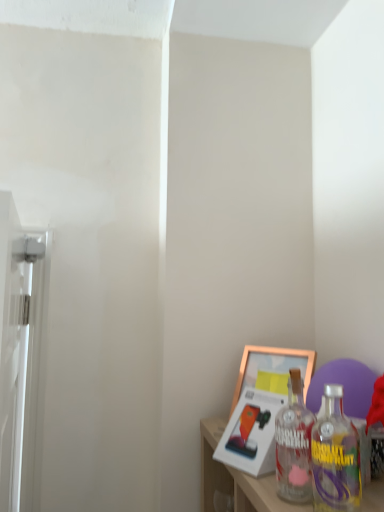
Question: From the image's perspective, would you say gold metallic picture frame at lower right, marked as the second picture frame in a front-to-back arrangement, is shown under gold metallic picture frame at lower right, acting as the 2th picture frame starting from the back?

Choices:
 (A) yes
 (B) no

Answer: (B)

Question: From a real-world perspective, is gold metallic picture frame at lower right, arranged as the first picture frame when viewed from the back, located beneath gold metallic picture frame at lower right, acting as the 2th picture frame starting from the back?

Choices:
 (A) yes
 (B) no

Answer: (B)

Question: Does gold metallic picture frame at lower right, marked as the second picture frame in a front-to-back arrangement, have a smaller size compared to gold metallic picture frame at lower right, which is counted as the first picture frame, starting from the front?

Choices:
 (A) yes
 (B) no

Answer: (B)

Question: Does gold metallic picture frame at lower right, marked as the second picture frame in a front-to-back arrangement, appear on the left side of gold metallic picture frame at lower right, which is counted as the first picture frame, starting from the front?

Choices:
 (A) no
 (B) yes

Answer: (A)

Question: Is gold metallic picture frame at lower right, marked as the second picture frame in a front-to-back arrangement, positioned behind gold metallic picture frame at lower right, acting as the 2th picture frame starting from the back?

Choices:
 (A) no
 (B) yes

Answer: (B)

Question: Is gold metallic picture frame at lower right, arranged as the first picture frame when viewed from the back, oriented towards gold metallic picture frame at lower right, which is counted as the first picture frame, starting from the front?

Choices:
 (A) no
 (B) yes

Answer: (B)

Question: Is gold metallic picture frame at lower right, acting as the 2th picture frame starting from the back, positioned in front of white glossy screen door at left?

Choices:
 (A) no
 (B) yes

Answer: (A)

Question: Considering the relative sizes of gold metallic picture frame at lower right, which is counted as the first picture frame, starting from the front, and white glossy screen door at left in the image provided, is gold metallic picture frame at lower right, which is counted as the first picture frame, starting from the front, smaller than white glossy screen door at left?

Choices:
 (A) yes
 (B) no

Answer: (A)

Question: From a real-world perspective, is gold metallic picture frame at lower right, which is counted as the first picture frame, starting from the front, positioned under white glossy screen door at left based on gravity?

Choices:
 (A) yes
 (B) no

Answer: (A)

Question: From a real-world perspective, is gold metallic picture frame at lower right, acting as the 2th picture frame starting from the back, on top of white glossy screen door at left?

Choices:
 (A) yes
 (B) no

Answer: (B)

Question: Would you say white glossy screen door at left is part of gold metallic picture frame at lower right, acting as the 2th picture frame starting from the back,'s contents?

Choices:
 (A) yes
 (B) no

Answer: (B)

Question: Is gold metallic picture frame at lower right, which is counted as the first picture frame, starting from the front, directly adjacent to white glossy screen door at left?

Choices:
 (A) no
 (B) yes

Answer: (A)

Question: Does clear glass bottle at lower right have a greater width compared to white glossy screen door at left?

Choices:
 (A) yes
 (B) no

Answer: (B)